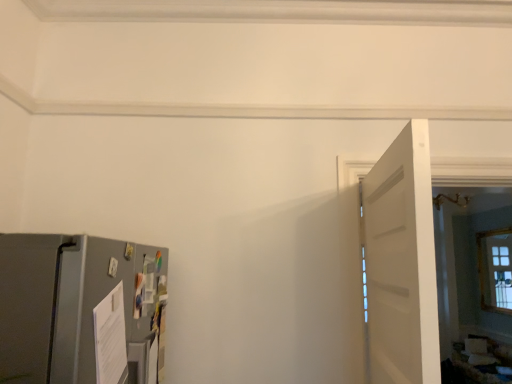
Question: Considering the relative positions of white matte door at right and satin gray refrigerator at lower left in the image provided, is white matte door at right to the right of satin gray refrigerator at lower left from the viewer's perspective?

Choices:
 (A) no
 (B) yes

Answer: (B)

Question: Does white matte door at right have a larger size compared to satin gray refrigerator at lower left?

Choices:
 (A) yes
 (B) no

Answer: (B)

Question: Would you say satin gray refrigerator at lower left is part of white matte door at right's contents?

Choices:
 (A) no
 (B) yes

Answer: (A)

Question: Is white matte door at right positioned far away from satin gray refrigerator at lower left?

Choices:
 (A) no
 (B) yes

Answer: (A)

Question: Is satin gray refrigerator at lower left at the back of white matte door at right?

Choices:
 (A) no
 (B) yes

Answer: (B)

Question: Is the position of white matte door at right less distant than that of satin gray refrigerator at lower left?

Choices:
 (A) no
 (B) yes

Answer: (A)

Question: Can white matte door at right be found inside satin gray refrigerator at lower left?

Choices:
 (A) yes
 (B) no

Answer: (B)

Question: Considering the relative sizes of satin gray refrigerator at lower left and white matte door at right in the image provided, is satin gray refrigerator at lower left thinner than white matte door at right?

Choices:
 (A) no
 (B) yes

Answer: (A)

Question: Is the depth of satin gray refrigerator at lower left less than that of white matte door at right?

Choices:
 (A) no
 (B) yes

Answer: (B)

Question: Would you consider satin gray refrigerator at lower left to be distant from white matte door at right?

Choices:
 (A) no
 (B) yes

Answer: (A)

Question: Is satin gray refrigerator at lower left to the left of white matte door at right from the viewer's perspective?

Choices:
 (A) yes
 (B) no

Answer: (A)

Question: Is satin gray refrigerator at lower left further to the viewer compared to white matte door at right?

Choices:
 (A) yes
 (B) no

Answer: (B)

Question: Is white matte door at right to the left or to the right of satin gray refrigerator at lower left in the image?

Choices:
 (A) right
 (B) left

Answer: (A)